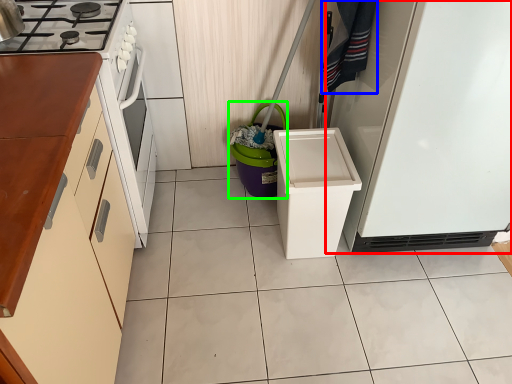
Question: Estimate the real-world distances between objects in this image. Which object is farther from refrigerator (highlighted by a red box), laundry (highlighted by a blue box) or appliance (highlighted by a green box)?

Choices:
 (A) laundry
 (B) appliance

Answer: (B)